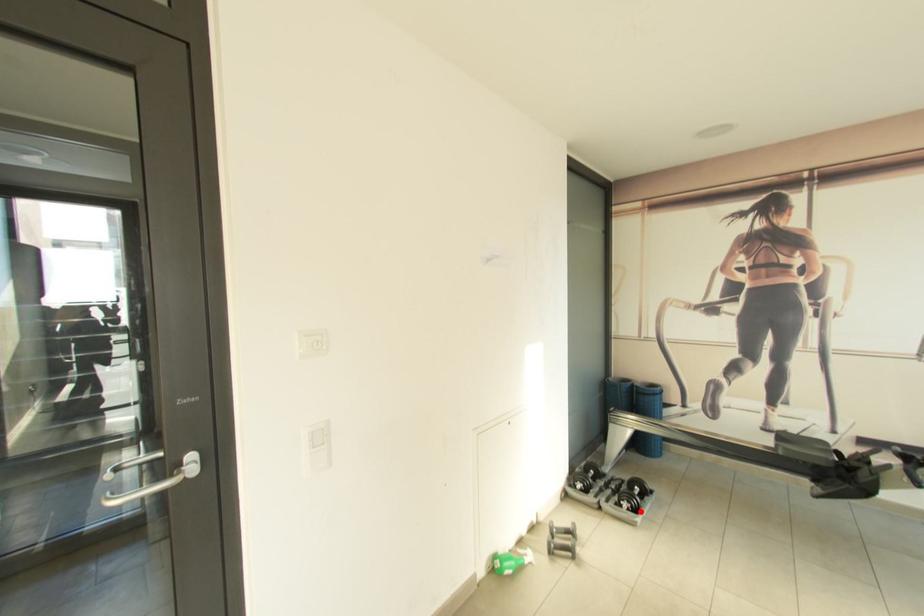
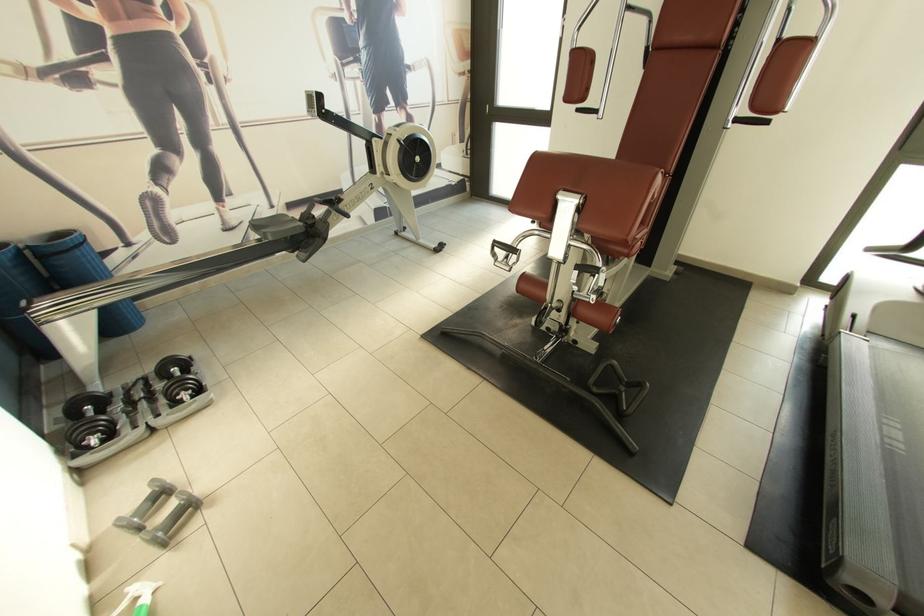
Where in the second image is the point corresponding to the highlighted location from the first image?

(204, 392)